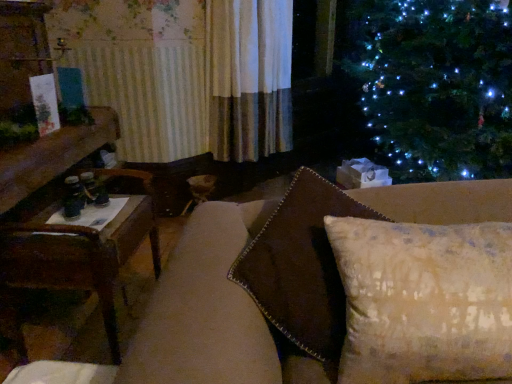
Image resolution: width=512 pixels, height=384 pixels. What are the coordinates of `brown wooden table at left` in the screenshot? It's located at (80, 255).

Describe the element at coordinates (80, 255) in the screenshot. The width and height of the screenshot is (512, 384). I see `brown wooden table at left` at that location.

The height and width of the screenshot is (384, 512). What do you see at coordinates (424, 300) in the screenshot?
I see `textured beige pillow at center` at bounding box center [424, 300].

The image size is (512, 384). I want to click on textured beige pillow at center, so (x=424, y=300).

Where is `brown wooden table at left`? brown wooden table at left is located at coordinates (80, 255).

Between brown wooden table at left and textured beige pillow at center, which one appears on the right side from the viewer's perspective?

textured beige pillow at center is more to the right.

Is brown wooden table at left in front of textured beige pillow at center?

No, brown wooden table at left is further to the viewer.

Considering the positions of points (106, 288) and (374, 244), is point (106, 288) closer to camera compared to point (374, 244)?

No, it is not.

From the image's perspective, is brown wooden table at left on textured beige pillow at center?

No, from the image's perspective, brown wooden table at left is not above textured beige pillow at center.

From a real-world perspective, which object rests below the other?

From a 3D spatial view, brown wooden table at left is below.

Which of these two, brown wooden table at left or textured beige pillow at center, is thinner?

With smaller width is textured beige pillow at center.

In terms of height, does brown wooden table at left look taller or shorter compared to textured beige pillow at center?

brown wooden table at left is taller than textured beige pillow at center.

Considering the sizes of objects brown wooden table at left and textured beige pillow at center in the image provided, who is bigger, brown wooden table at left or textured beige pillow at center?

brown wooden table at left.

Is brown wooden table at left situated inside textured beige pillow at center or outside?

brown wooden table at left is not inside textured beige pillow at center, it's outside.

Is brown wooden table at left next to textured beige pillow at center?

brown wooden table at left and textured beige pillow at center are clearly separated.

Is brown wooden table at left facing towards textured beige pillow at center?

No, brown wooden table at left is not aimed at textured beige pillow at center.

What's the angular difference between brown wooden table at left and textured beige pillow at center's facing directions?

The angle between the facing direction of brown wooden table at left and the facing direction of textured beige pillow at center is 94 degrees.

This screenshot has width=512, height=384. Find the location of `pillow on the right of brown wooden table at left`. pillow on the right of brown wooden table at left is located at coordinates (424, 300).

Considering the positions of objects textured beige pillow at center and brown wooden table at left in the image provided, who is more to the right, textured beige pillow at center or brown wooden table at left?

textured beige pillow at center is more to the right.

Relative to brown wooden table at left, is textured beige pillow at center in front or behind?

In the image, textured beige pillow at center appears in front of brown wooden table at left.

Is point (413, 238) more distant than point (103, 276)?

No, it is in front of (103, 276).

From the image's perspective, which object appears higher, textured beige pillow at center or brown wooden table at left?

textured beige pillow at center is shown above in the image.

From a real-world perspective, is textured beige pillow at center physically above brown wooden table at left?

Yes, from a real-world perspective, textured beige pillow at center is on top of brown wooden table at left.

Which object is thinner, textured beige pillow at center or brown wooden table at left?

textured beige pillow at center is thinner.

Looking at this image, who is shorter, textured beige pillow at center or brown wooden table at left?

textured beige pillow at center.

Can you confirm if textured beige pillow at center is smaller than brown wooden table at left?

Yes, textured beige pillow at center is smaller than brown wooden table at left.

Consider the image. Would you say textured beige pillow at center contains brown wooden table at left?

Actually, brown wooden table at left is outside textured beige pillow at center.

Is textured beige pillow at center far from brown wooden table at left?

textured beige pillow at center is near brown wooden table at left, not far away.

Is textured beige pillow at center turned away from brown wooden table at left?

No.

Where is `pillow in front of the brown wooden table at left`? The height and width of the screenshot is (384, 512). pillow in front of the brown wooden table at left is located at coordinates (424, 300).

Locate an element on the screen. table behind the textured beige pillow at center is located at coordinates (80, 255).

Locate an element on the screen. Image resolution: width=512 pixels, height=384 pixels. table that appears below the textured beige pillow at center (from a real-world perspective) is located at coordinates (80, 255).